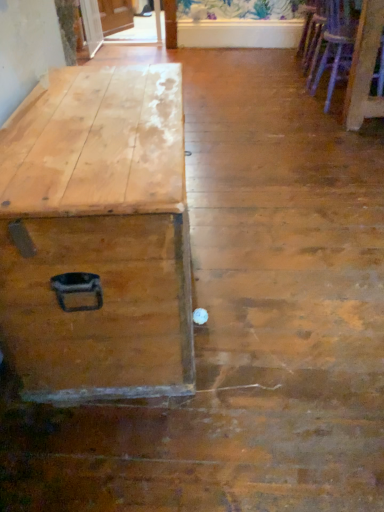
Locate an element on the screen. This screenshot has height=512, width=384. vacant region above natural wood trunk at left (from a real-world perspective) is located at coordinates (102, 110).